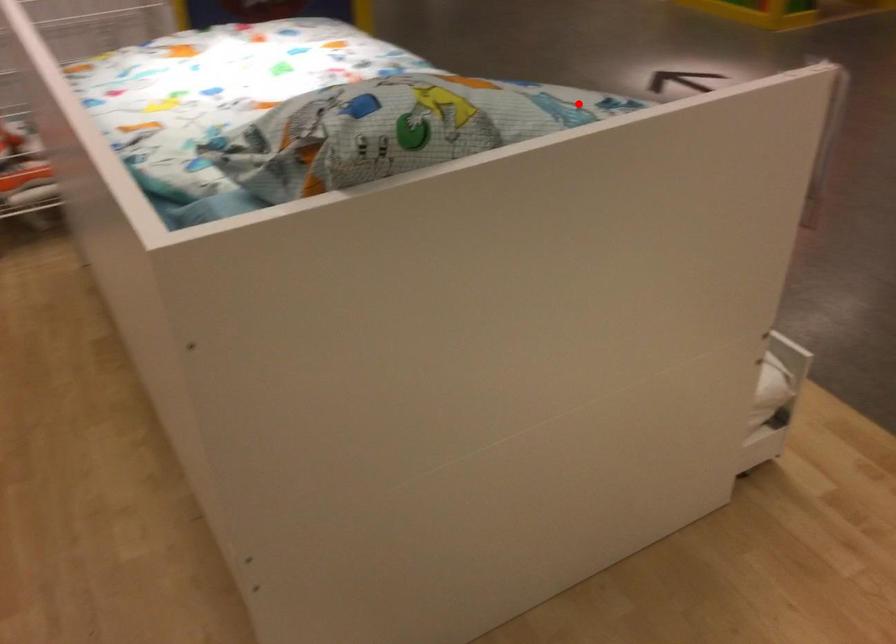
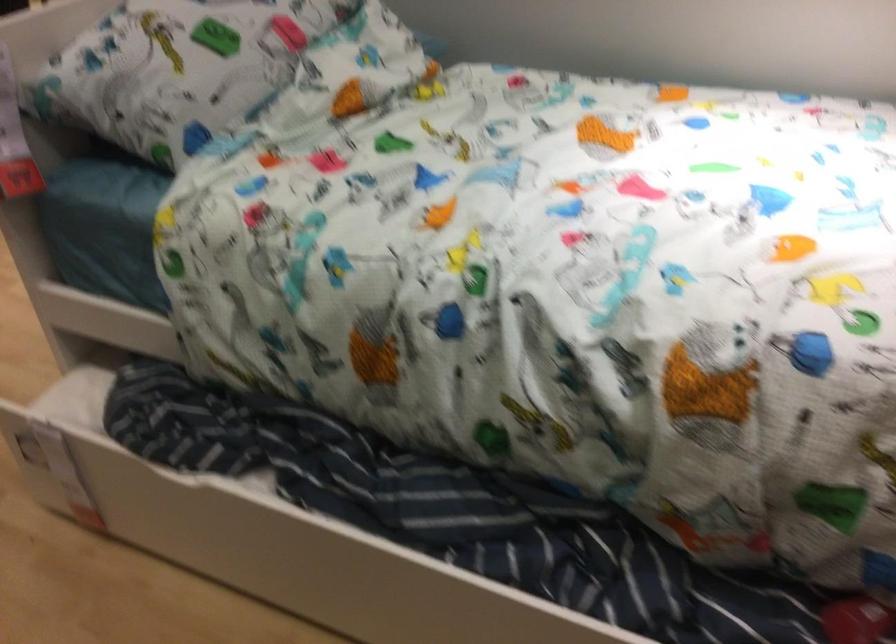
The point at the highlighted location is marked in the first image. Where is the corresponding point in the second image?

(177, 62)